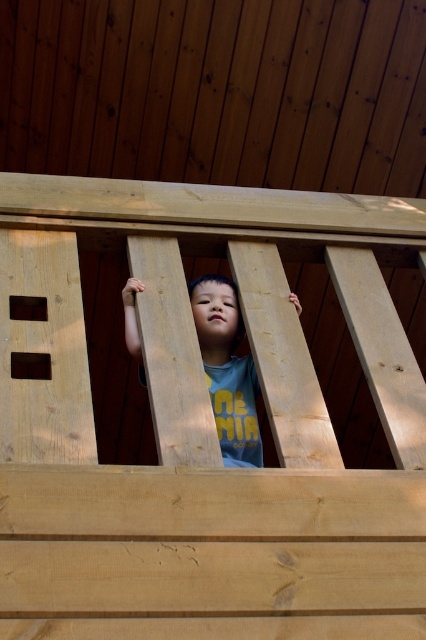
You are a parent trying to ensure your child is safe while playing on the natural wood bunk bed at center. Considering the position of the matte wood child at center, can you confirm if the child is in a safe spot below the bunk bed?

The natural wood bunk bed at center is positioned over the matte wood child at center, so the child is directly underneath the bunk bed. This position may pose a safety risk as items could fall from the bed onto the child.

You are a parent trying to ensure your child is safe while playing on the natural wood bunk bed at center and the matte wood child at center. Which object is positioned to the right side of the other?

The natural wood bunk bed at center is to the left of the matte wood child at center, so the matte wood child at center is positioned to the right of the natural wood bunk bed at center.

You are helping to set up a play area and need to ensure safety. The natural wood bunk bed at center and the matte wood child at center are in the scene. Which object is taller and requires more vertical space?

The natural wood bunk bed at center is taller than the matte wood child at center, so it requires more vertical space.